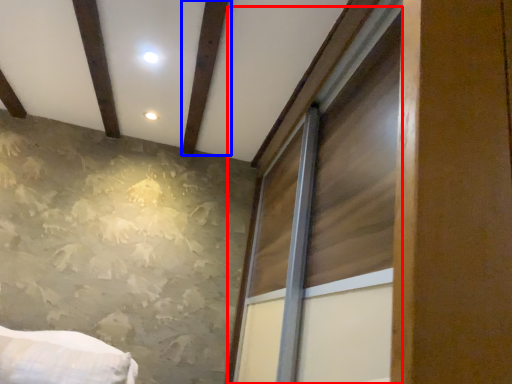
Question: Which of the following is the closest to the observer, window (highlighted by a red box) or plank (highlighted by a blue box)?

Choices:
 (A) window
 (B) plank

Answer: (A)